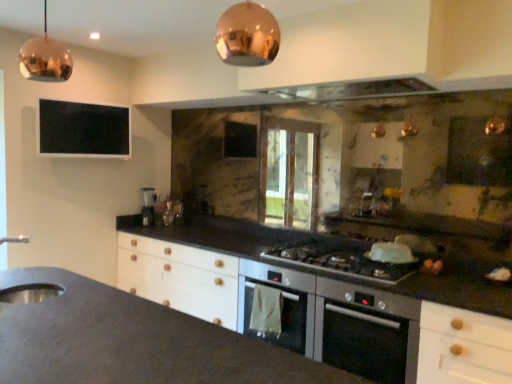
Question: Is satin silver blender at center wider than satin silver gas stove at center?

Choices:
 (A) yes
 (B) no

Answer: (B)

Question: Considering the relative positions of satin silver blender at center and satin silver gas stove at center in the image provided, is satin silver blender at center to the right of satin silver gas stove at center from the viewer's perspective?

Choices:
 (A) no
 (B) yes

Answer: (A)

Question: From a real-world perspective, does satin silver blender at center stand above satin silver gas stove at center?

Choices:
 (A) yes
 (B) no

Answer: (A)

Question: From the image's perspective, is satin silver blender at center below satin silver gas stove at center?

Choices:
 (A) yes
 (B) no

Answer: (B)

Question: Are satin silver blender at center and satin silver gas stove at center making contact?

Choices:
 (A) no
 (B) yes

Answer: (A)

Question: Would you say satin silver blender at center is outside satin silver gas stove at center?

Choices:
 (A) no
 (B) yes

Answer: (B)

Question: Is black matte window screen at upper left positioned in front of copper reflective pendant light at upper left, the 1th light fixture from the back?

Choices:
 (A) yes
 (B) no

Answer: (B)

Question: Is black matte window screen at upper left wider than copper reflective pendant light at upper left, marked as the 1th light fixture in a left-to-right arrangement?

Choices:
 (A) yes
 (B) no

Answer: (B)

Question: Can copper reflective pendant light at upper left, the second light fixture when ordered from right to left, be found inside black matte window screen at upper left?

Choices:
 (A) yes
 (B) no

Answer: (B)

Question: Does black matte window screen at upper left touch copper reflective pendant light at upper left, acting as the 2th light fixture starting from the front?

Choices:
 (A) no
 (B) yes

Answer: (A)

Question: Considering the relative positions of black matte window screen at upper left and copper reflective pendant light at upper left, the 1th light fixture from the back, in the image provided, is black matte window screen at upper left to the left of copper reflective pendant light at upper left, the 1th light fixture from the back, from the viewer's perspective?

Choices:
 (A) yes
 (B) no

Answer: (A)

Question: From the image's perspective, is black matte window screen at upper left on top of copper reflective pendant light at upper left, the second light fixture when ordered from right to left?

Choices:
 (A) no
 (B) yes

Answer: (A)

Question: Considering the relative sizes of metallic glass at upper center and copper reflective pendant light at upper center, which is the 2th light fixture in back-to-front order, in the image provided, is metallic glass at upper center shorter than copper reflective pendant light at upper center, which is the 2th light fixture in back-to-front order,?

Choices:
 (A) no
 (B) yes

Answer: (B)